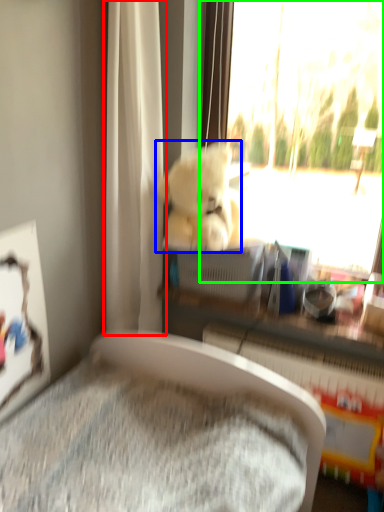
Question: Which object is positioned farthest from curtain (highlighted by a red box)? Select from teddy bear (highlighted by a blue box) and window (highlighted by a green box).

Choices:
 (A) teddy bear
 (B) window

Answer: (B)